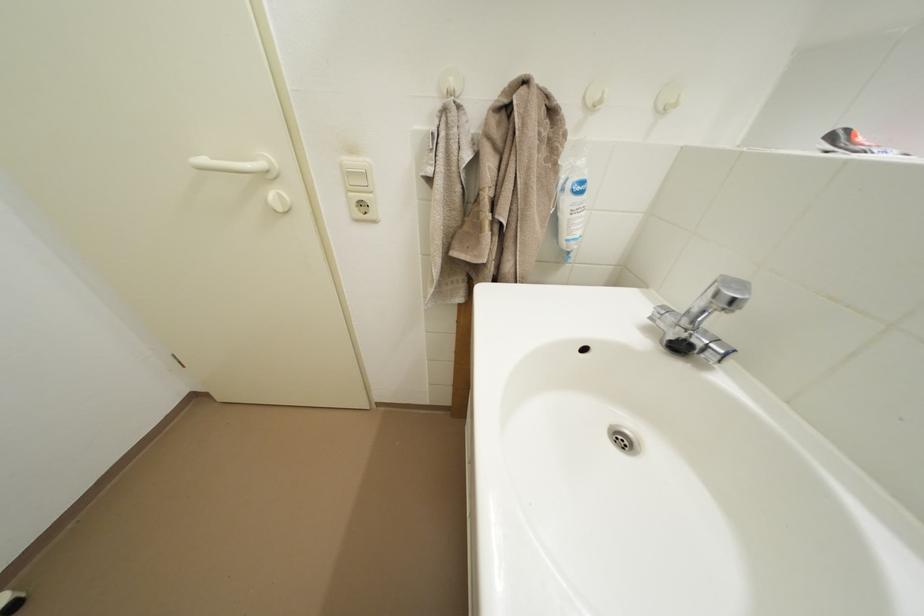
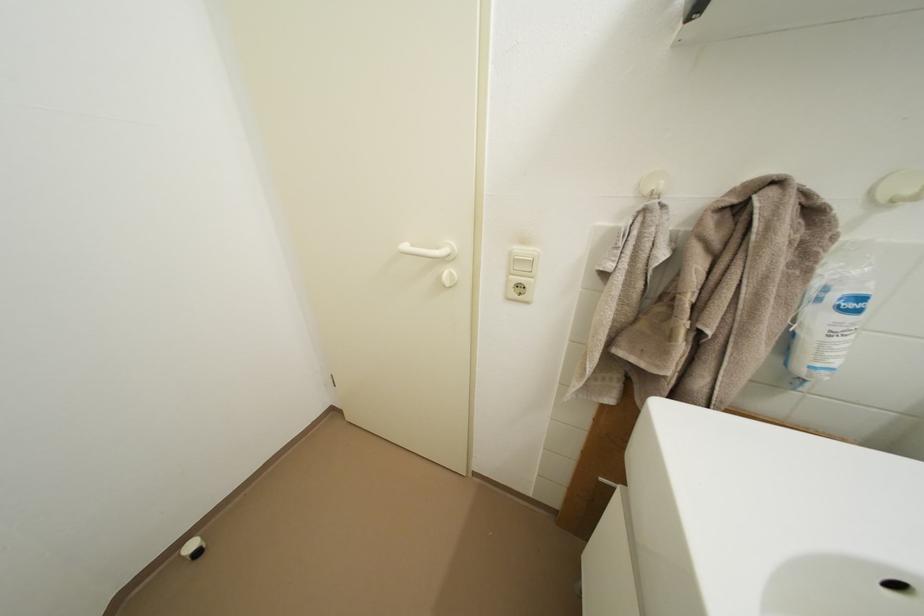
Question: How did the camera likely rotate?

Choices:
 (A) Left
 (B) Right
 (C) Up
 (D) Down

Answer: (A)